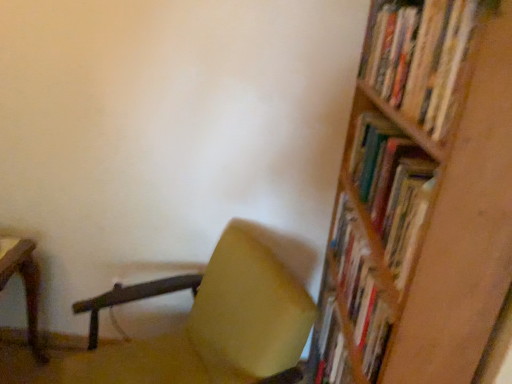
Question: Does wooden bookshelf at upper right have a lesser height compared to wooden bookshelf at right?

Choices:
 (A) no
 (B) yes

Answer: (B)

Question: From a real-world perspective, is wooden bookshelf at upper right physically above wooden bookshelf at right?

Choices:
 (A) yes
 (B) no

Answer: (A)

Question: Are wooden bookshelf at upper right and wooden bookshelf at right far apart?

Choices:
 (A) no
 (B) yes

Answer: (A)

Question: From the image's perspective, is wooden bookshelf at upper right on top of wooden bookshelf at right?

Choices:
 (A) yes
 (B) no

Answer: (A)

Question: Is wooden bookshelf at upper right smaller than wooden bookshelf at right?

Choices:
 (A) no
 (B) yes

Answer: (B)

Question: Is wooden bookshelf at upper right further to camera compared to wooden bookshelf at right?

Choices:
 (A) yes
 (B) no

Answer: (A)

Question: From a real-world perspective, is wooden bookshelf at upper right over matte yellow chair at center?

Choices:
 (A) yes
 (B) no

Answer: (A)

Question: Can you confirm if wooden bookshelf at upper right is thinner than matte yellow chair at center?

Choices:
 (A) yes
 (B) no

Answer: (A)

Question: Considering the relative sizes of wooden bookshelf at upper right and matte yellow chair at center in the image provided, is wooden bookshelf at upper right smaller than matte yellow chair at center?

Choices:
 (A) yes
 (B) no

Answer: (A)

Question: Does wooden bookshelf at upper right appear on the right side of matte yellow chair at center?

Choices:
 (A) no
 (B) yes

Answer: (B)

Question: Is wooden bookshelf at upper right not inside matte yellow chair at center?

Choices:
 (A) yes
 (B) no

Answer: (A)

Question: Can matte yellow chair at center be found inside wooden bookshelf at upper right?

Choices:
 (A) no
 (B) yes

Answer: (A)

Question: Is matte yellow chair at center positioned before wooden bookshelf at right?

Choices:
 (A) yes
 (B) no

Answer: (B)